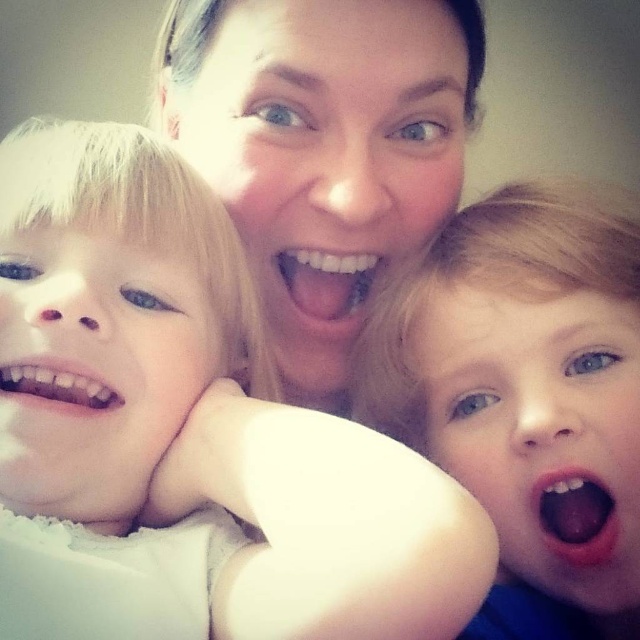
You are standing at the point labeled as point (547, 474) in the image. You want to throw a ball to a friend who is standing 40 centimeters away from you. Is your friend within reach?

The distance between you and the viewer is 42.75 centimeters, which is slightly more than 40 centimeters. Therefore, your friend is just out of reach.

You are holding a 35 cm long ruler and want to measure the distance from your eyes to the point at coordinates point (221, 452). Can your ruler reach that distance?

The distance between point (221, 452) and the camera is 40.03 centimeters. Since the ruler is only 35 cm long, it cannot reach the full distance. You would need a longer measuring tool.

What is located at the coordinates point (x=576, y=515) in the image?

The coordinates point (x=576, y=515) marks the pink glossy lips at center.